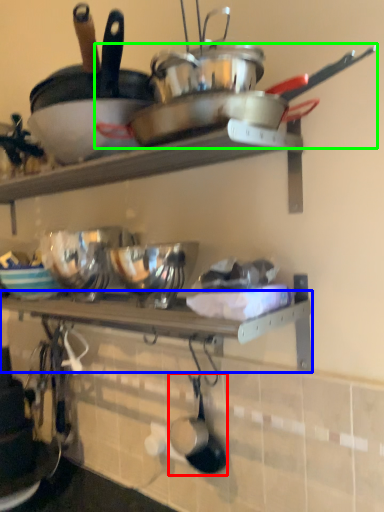
Question: Based on their relative distances, which object is nearer to frying pan (highlighted by a red box)? Choose from shelf (highlighted by a blue box) and wok (highlighted by a green box).

Choices:
 (A) shelf
 (B) wok

Answer: (A)